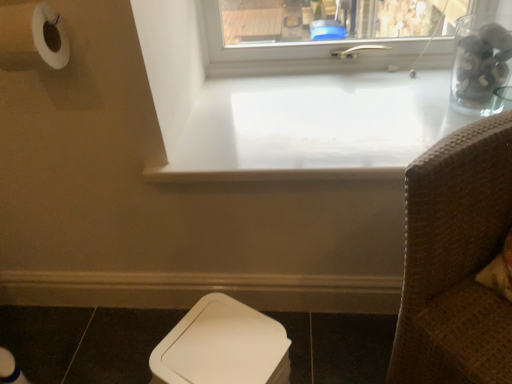
Identify the location of vacant area on top of white plastic toilet bowl at lower center (from a real-world perspective). Image resolution: width=512 pixels, height=384 pixels. (213, 341).